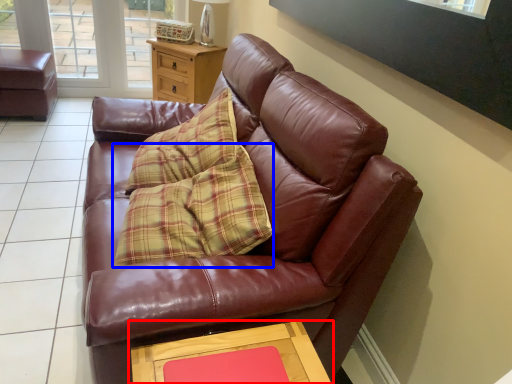
Question: Which object is closer to the camera taking this photo, table (highlighted by a red box) or pillow (highlighted by a blue box)?

Choices:
 (A) table
 (B) pillow

Answer: (A)